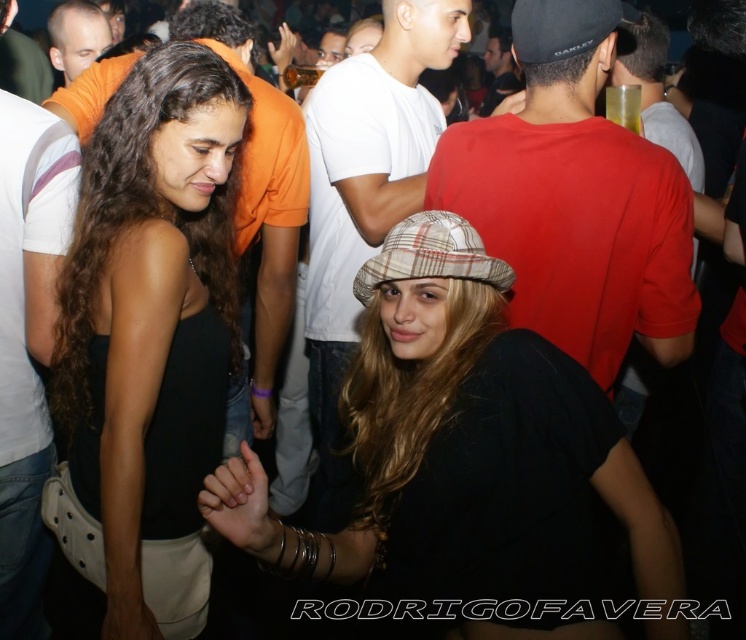
Who is positioned more to the right, matte black tank top at center or white striped t-shirt at left?

matte black tank top at center is more to the right.

Is the position of matte black tank top at center less distant than that of white striped t-shirt at left?

Yes, it is in front of white striped t-shirt at left.

This screenshot has height=640, width=746. I want to click on matte black tank top at center, so click(150, 310).

Who is positioned more to the left, plaid fabric hat at center or white striped t-shirt at left?

white striped t-shirt at left is more to the left.

Which of these two, plaid fabric hat at center or white striped t-shirt at left, stands shorter?

plaid fabric hat at center

Looking at this image, who is more distant from viewer, (445,508) or (34,424)?

The point (34,424) is more distant.

In order to click on plaid fabric hat at center in this screenshot , I will do `click(457, 440)`.

Is matte black tank top at center to the right of orange t-shirt at upper left from the viewer's perspective?

Correct, you'll find matte black tank top at center to the right of orange t-shirt at upper left.

Is matte black tank top at center bigger than orange t-shirt at upper left?

Yes, matte black tank top at center is bigger than orange t-shirt at upper left.

Who is more forward, (59, 378) or (75, 42)?

Point (59, 378)

Identify the location of matte black tank top at center. This screenshot has width=746, height=640. (150, 310).